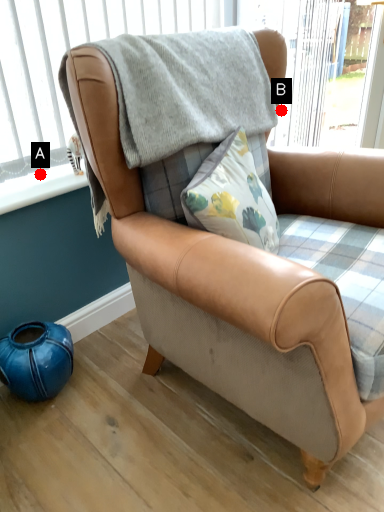
Question: Two points are circled on the image, labeled by A and B beside each circle. Which point is closer to the camera taking this photo?

Choices:
 (A) A is closer
 (B) B is closer

Answer: (A)